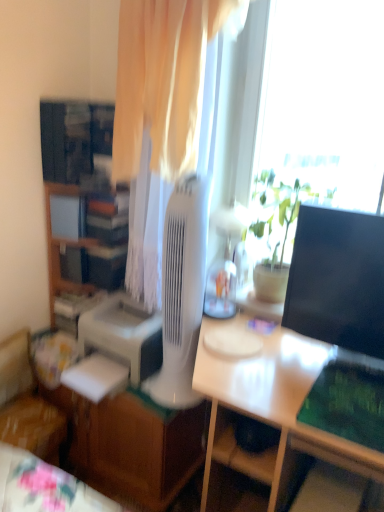
The image size is (384, 512). What are the coordinates of `vacant position to the left of black glossy monitor at right` in the screenshot? It's located at (281, 358).